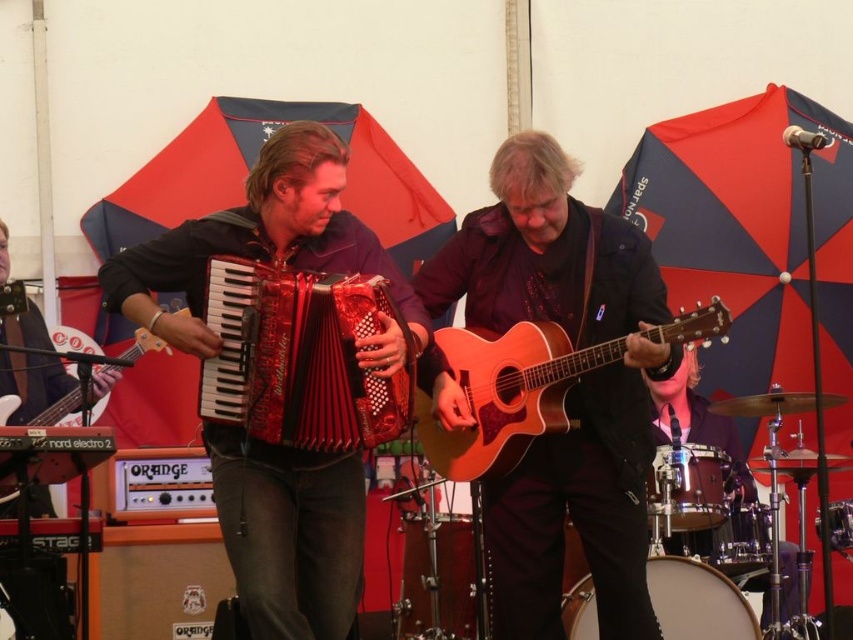
Question: Among these objects, which one is farthest from the camera?

Choices:
 (A) matte black accordion at left
 (B) metallic red accordion at center
 (C) matte black guitar at center

Answer: (A)

Question: Does red shiny accordion at center have a larger size compared to matte black guitar at center?

Choices:
 (A) no
 (B) yes

Answer: (B)

Question: Which point is closer to the camera?

Choices:
 (A) matte black accordion at left
 (B) natural wood acoustic guitar at center

Answer: (B)

Question: Is red shiny accordion at center wider than matte black guitar at center?

Choices:
 (A) no
 (B) yes

Answer: (B)

Question: Which of the following is the farthest from the observer?

Choices:
 (A) brown leather guitar at center
 (B) matte black guitar at center
 (C) red shiny accordion at center
 (D) matte black accordion at left

Answer: (D)

Question: Does brown leather guitar at center lie in front of metallic red accordion at center?

Choices:
 (A) no
 (B) yes

Answer: (A)